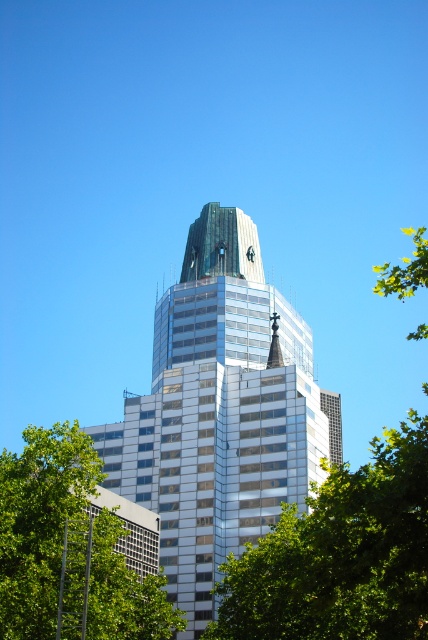
Question: Does green leafy tree at center appear over green leafy tree at lower left?

Choices:
 (A) no
 (B) yes

Answer: (B)

Question: Estimate the real-world distances between objects in this image. Which object is farther from the metallic glass tower at center?

Choices:
 (A) green leafy tree at center
 (B) green leafy tree at lower left

Answer: (B)

Question: Can you confirm if green leafy tree at center is positioned to the left of green leafy tree at lower left?

Choices:
 (A) yes
 (B) no

Answer: (B)

Question: Which point is farther to the camera?

Choices:
 (A) metallic glass tower at center
 (B) green leafy tree at lower left

Answer: (A)

Question: Which object appears farthest from the camera in this image?

Choices:
 (A) metallic glass tower at center
 (B) green leafy tree at lower left

Answer: (A)

Question: Observing the image, what is the correct spatial positioning of metallic glass tower at center in reference to green leafy tree at lower left?

Choices:
 (A) below
 (B) above

Answer: (B)